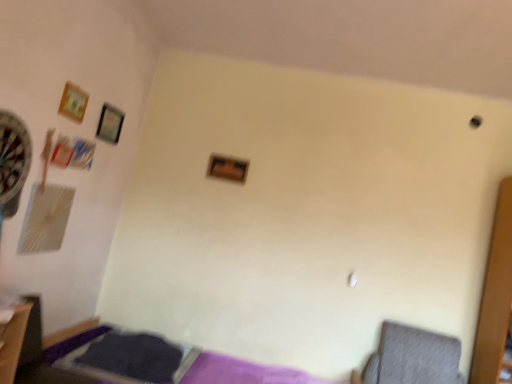
What do you see at coordinates (73, 102) in the screenshot? I see `wooden frame at upper left, marked as the 1th picture frame in a front-to-back arrangement` at bounding box center [73, 102].

Where is `matte black picture frame at upper left, the 2th picture frame in the right-to-left sequence`? The height and width of the screenshot is (384, 512). matte black picture frame at upper left, the 2th picture frame in the right-to-left sequence is located at coordinates (110, 124).

Identify the location of wooden frame at upper left, marked as the 1th picture frame in a front-to-back arrangement. (73, 102).

Where is `swivel chair below the matte black picture frame at upper left, the second picture frame viewed from the front (from a real-world perspective)`? swivel chair below the matte black picture frame at upper left, the second picture frame viewed from the front (from a real-world perspective) is located at coordinates (413, 357).

Is gray fabric swivel chair at lower right beside matte black picture frame at upper left, the second picture frame viewed from the front?

No.

Which object is wider, gray fabric swivel chair at lower right or matte black picture frame at upper left, the second picture frame viewed from the front?

Wider between the two is gray fabric swivel chair at lower right.

Would you say wooden frame at upper left, acting as the 3th picture frame starting from the right, is outside matte black picture frame at upper left, the 2th picture frame in the right-to-left sequence?

Yes, wooden frame at upper left, acting as the 3th picture frame starting from the right, is located beyond the bounds of matte black picture frame at upper left, the 2th picture frame in the right-to-left sequence.

Considering the relative sizes of wooden frame at upper left, the 3th picture frame in the back-to-front sequence, and matte black picture frame at upper left, the 2th picture frame in the back-to-front sequence, in the image provided, is wooden frame at upper left, the 3th picture frame in the back-to-front sequence, taller than matte black picture frame at upper left, the 2th picture frame in the back-to-front sequence,?

In fact, wooden frame at upper left, the 3th picture frame in the back-to-front sequence, may be shorter than matte black picture frame at upper left, the 2th picture frame in the back-to-front sequence.

Measure the distance from wooden frame at upper left, the first picture frame positioned from the left, to matte black picture frame at upper left, the 2th picture frame in the back-to-front sequence.

The distance of wooden frame at upper left, the first picture frame positioned from the left, from matte black picture frame at upper left, the 2th picture frame in the back-to-front sequence, is 12.12 inches.

Is wooden frame at upper left, acting as the 3th picture frame starting from the right, bigger or smaller than matte black picture frame at upper left, the 2th picture frame in the right-to-left sequence?

In the image, wooden frame at upper left, acting as the 3th picture frame starting from the right, appears to be smaller than matte black picture frame at upper left, the 2th picture frame in the right-to-left sequence.

From a real-world perspective, which object rests below the other?

In real-world perspective, matte black picture frame at upper left, the 2th picture frame in the back-to-front sequence, is lower.

Between matte black picture frame at upper left, the 2th picture frame in the back-to-front sequence, and wooden frame at upper left, acting as the 3th picture frame starting from the right, which one has larger width?

Wider between the two is matte black picture frame at upper left, the 2th picture frame in the back-to-front sequence.

From the picture: Is matte black picture frame at upper left, the 2th picture frame in the back-to-front sequence, facing towards wooden frame at upper left, the first picture frame positioned from the left?

No, matte black picture frame at upper left, the 2th picture frame in the back-to-front sequence, is not aimed at wooden frame at upper left, the first picture frame positioned from the left.

Between matte black picture frame at upper left, positioned as the second picture frame in left-to-right order, and wooden frame at upper left, acting as the 3th picture frame starting from the right, which one has smaller size?

With smaller size is wooden frame at upper left, acting as the 3th picture frame starting from the right.

In the image, is wooden frame at center, marked as the 1th picture frame in a right-to-left arrangement, positioned in front of or behind matte black picture frame at upper left, positioned as the second picture frame in left-to-right order?

wooden frame at center, marked as the 1th picture frame in a right-to-left arrangement, is positioned farther from the viewer than matte black picture frame at upper left, positioned as the second picture frame in left-to-right order.

Considering the points (211, 162) and (116, 131), which point is behind, point (211, 162) or point (116, 131)?

The point (211, 162) is behind.

Image resolution: width=512 pixels, height=384 pixels. Find the location of `picture frame behind the matte black picture frame at upper left, the second picture frame viewed from the front`. picture frame behind the matte black picture frame at upper left, the second picture frame viewed from the front is located at coordinates (227, 168).

From the image's perspective, between wooden frame at center, marked as the 1th picture frame in a right-to-left arrangement, and matte black picture frame at upper left, positioned as the second picture frame in left-to-right order, who is located below?

wooden frame at center, marked as the 1th picture frame in a right-to-left arrangement, is shown below in the image.

In terms of size, does wooden frame at upper left, acting as the 3th picture frame starting from the right, appear bigger or smaller than wooden frame at center, the third picture frame from the left?

Considering their sizes, wooden frame at upper left, acting as the 3th picture frame starting from the right, takes up less space than wooden frame at center, the third picture frame from the left.

Image resolution: width=512 pixels, height=384 pixels. I want to click on picture frame that is the 2nd object located in front of the wooden frame at center, the first picture frame when ordered from back to front, so click(x=73, y=102).

Considering the relative positions of wooden frame at upper left, the first picture frame positioned from the left, and wooden frame at center, the third picture frame from the left, in the image provided, is wooden frame at upper left, the first picture frame positioned from the left, behind wooden frame at center, the third picture frame from the left,?

No, wooden frame at upper left, the first picture frame positioned from the left, is closer to the camera.

Considering the sizes of objects metallic silver dartboard at left and purple fabric bed at lower left in the image provided, who is bigger, metallic silver dartboard at left or purple fabric bed at lower left?

purple fabric bed at lower left is bigger.

Between metallic silver dartboard at left and purple fabric bed at lower left, which one has smaller width?

metallic silver dartboard at left is thinner.

From a real-world perspective, who is located higher, metallic silver dartboard at left or purple fabric bed at lower left?

In real-world perspective, metallic silver dartboard at left is above.

Is metallic silver dartboard at left shorter than purple fabric bed at lower left?

Yes.

Considering the sizes of objects purple fabric bed at lower left and wooden frame at upper left, acting as the 3th picture frame starting from the right, in the image provided, who is taller, purple fabric bed at lower left or wooden frame at upper left, acting as the 3th picture frame starting from the right,?

Standing taller between the two is purple fabric bed at lower left.

Is purple fabric bed at lower left far away from wooden frame at upper left, the 3th picture frame in the back-to-front sequence?

Yes.

From a real-world perspective, which is physically below, purple fabric bed at lower left or wooden frame at upper left, the first picture frame positioned from the left?

purple fabric bed at lower left.

From the image's perspective, is purple fabric bed at lower left on wooden frame at upper left, marked as the 1th picture frame in a front-to-back arrangement?

Incorrect, from the image's perspective, purple fabric bed at lower left is lower than wooden frame at upper left, marked as the 1th picture frame in a front-to-back arrangement.

Identify the location of swivel chair below the matte black picture frame at upper left, the second picture frame viewed from the front (from a real-world perspective). (413, 357).

The width and height of the screenshot is (512, 384). What are the coordinates of `picture frame in front of the matte black picture frame at upper left, the 2th picture frame in the right-to-left sequence` in the screenshot? It's located at (73, 102).

From the image, which object appears to be nearer to metallic silver dartboard at left, gray fabric swivel chair at lower right or wooden frame at upper left, the first picture frame positioned from the left?

Among the two, wooden frame at upper left, the first picture frame positioned from the left, is located nearer to metallic silver dartboard at left.

When comparing their distances from wooden frame at upper left, acting as the 3th picture frame starting from the right, does wooden frame at center, the first picture frame when ordered from back to front, or purple fabric bed at lower left seem closer?

wooden frame at center, the first picture frame when ordered from back to front, is positioned closer to the anchor wooden frame at upper left, acting as the 3th picture frame starting from the right.

Estimate the real-world distances between objects in this image. Which object is further from wooden frame at upper left, marked as the 1th picture frame in a front-to-back arrangement, matte black picture frame at upper left, the 2th picture frame in the back-to-front sequence, or metallic silver dartboard at left?

metallic silver dartboard at left is positioned further to the anchor wooden frame at upper left, marked as the 1th picture frame in a front-to-back arrangement.

Which object lies further to the anchor point wooden frame at upper left, marked as the 1th picture frame in a front-to-back arrangement, wooden frame at center, positioned as the third picture frame in front-to-back order, or gray fabric swivel chair at lower right?

gray fabric swivel chair at lower right lies further to wooden frame at upper left, marked as the 1th picture frame in a front-to-back arrangement, than the other object.

Based on their spatial positions, is metallic silver dartboard at left or purple fabric bed at lower left closer to wooden frame at center, marked as the 1th picture frame in a right-to-left arrangement?

Among the two, purple fabric bed at lower left is located nearer to wooden frame at center, marked as the 1th picture frame in a right-to-left arrangement.

Looking at the image, which one is located closer to gray fabric swivel chair at lower right, wooden frame at center, marked as the 1th picture frame in a right-to-left arrangement, or wooden frame at upper left, acting as the 3th picture frame starting from the right?

Based on the image, wooden frame at center, marked as the 1th picture frame in a right-to-left arrangement, appears to be nearer to gray fabric swivel chair at lower right.

Considering their positions, is matte black picture frame at upper left, the 2th picture frame in the right-to-left sequence, positioned further to gray fabric swivel chair at lower right than purple fabric bed at lower left?

The object further to gray fabric swivel chair at lower right is matte black picture frame at upper left, the 2th picture frame in the right-to-left sequence.

Estimate the real-world distances between objects in this image. Which object is further from purple fabric bed at lower left, matte black picture frame at upper left, the 2th picture frame in the right-to-left sequence, or wooden frame at center, positioned as the third picture frame in front-to-back order?

matte black picture frame at upper left, the 2th picture frame in the right-to-left sequence, is further to purple fabric bed at lower left.

Where is `fan between wooden frame at center, the third picture frame from the left, and purple fabric bed at lower left in the up-down direction`? This screenshot has height=384, width=512. fan between wooden frame at center, the third picture frame from the left, and purple fabric bed at lower left in the up-down direction is located at coordinates (13, 158).

Where is `fan that lies between wooden frame at upper left, marked as the 1th picture frame in a front-to-back arrangement, and purple fabric bed at lower left from top to bottom`? This screenshot has height=384, width=512. fan that lies between wooden frame at upper left, marked as the 1th picture frame in a front-to-back arrangement, and purple fabric bed at lower left from top to bottom is located at coordinates (13, 158).

The width and height of the screenshot is (512, 384). Identify the location of swivel chair between wooden frame at center, positioned as the third picture frame in front-to-back order, and purple fabric bed at lower left in the up-down direction. (413, 357).

This screenshot has height=384, width=512. I want to click on picture frame positioned between metallic silver dartboard at left and matte black picture frame at upper left, the 2th picture frame in the right-to-left sequence, from near to far, so click(73, 102).